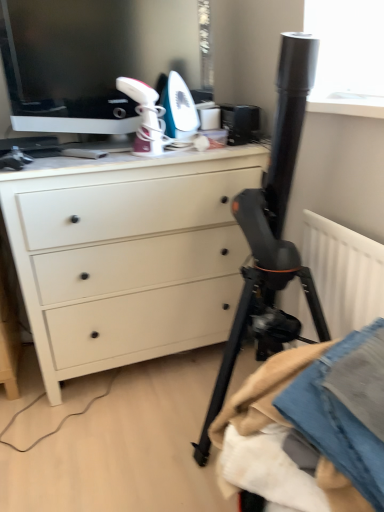
Question: Can you confirm if matte black monitor at upper left is wider than denim fabric at lower right?

Choices:
 (A) no
 (B) yes

Answer: (A)

Question: Is matte black monitor at upper left positioned with its back to denim fabric at lower right?

Choices:
 (A) no
 (B) yes

Answer: (A)

Question: Are matte black monitor at upper left and denim fabric at lower right beside each other?

Choices:
 (A) no
 (B) yes

Answer: (A)

Question: Can you confirm if matte black monitor at upper left is bigger than denim fabric at lower right?

Choices:
 (A) yes
 (B) no

Answer: (A)

Question: Is matte black monitor at upper left thinner than denim fabric at lower right?

Choices:
 (A) yes
 (B) no

Answer: (A)

Question: From the image's perspective, is denim fabric at lower right positioned above or below matte black monitor at upper left?

Choices:
 (A) below
 (B) above

Answer: (A)

Question: In terms of size, does denim fabric at lower right appear bigger or smaller than matte black monitor at upper left?

Choices:
 (A) small
 (B) big

Answer: (A)

Question: From a real-world perspective, is denim fabric at lower right positioned above or below matte black monitor at upper left?

Choices:
 (A) below
 (B) above

Answer: (A)

Question: Is denim fabric at lower right spatially inside matte black monitor at upper left, or outside of it?

Choices:
 (A) inside
 (B) outside

Answer: (B)

Question: In terms of height, does denim fabric at lower right look taller or shorter compared to white matte chest of drawers at center?

Choices:
 (A) short
 (B) tall

Answer: (A)

Question: From a real-world perspective, relative to white matte chest of drawers at center, is denim fabric at lower right vertically above or below?

Choices:
 (A) above
 (B) below

Answer: (B)

Question: Visually, is denim fabric at lower right positioned to the left or to the right of white matte chest of drawers at center?

Choices:
 (A) right
 (B) left

Answer: (A)

Question: Is denim fabric at lower right wider or thinner than white matte chest of drawers at center?

Choices:
 (A) wide
 (B) thin

Answer: (B)

Question: From a real-world perspective, relative to white matte chest of drawers at center, is matte black monitor at upper left vertically above or below?

Choices:
 (A) below
 (B) above

Answer: (B)

Question: Is matte black monitor at upper left taller or shorter than white matte chest of drawers at center?

Choices:
 (A) tall
 (B) short

Answer: (B)